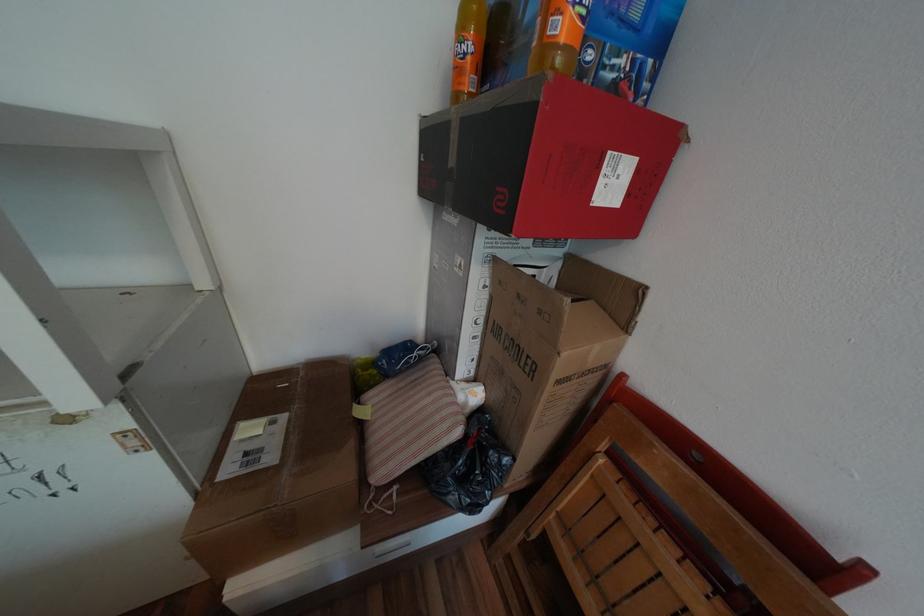
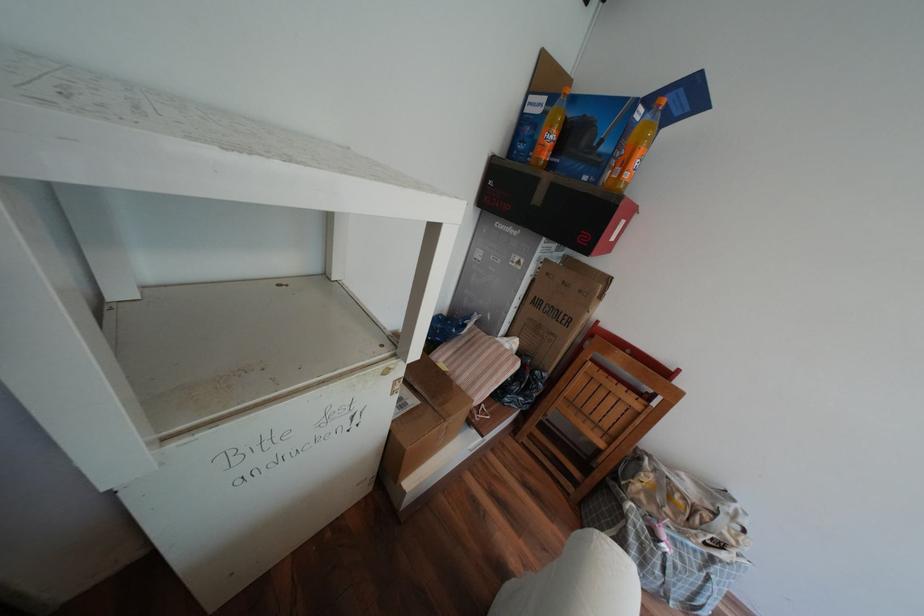
Find the pixel in the second image that matches pixel 453 419 in the first image.

(517, 360)